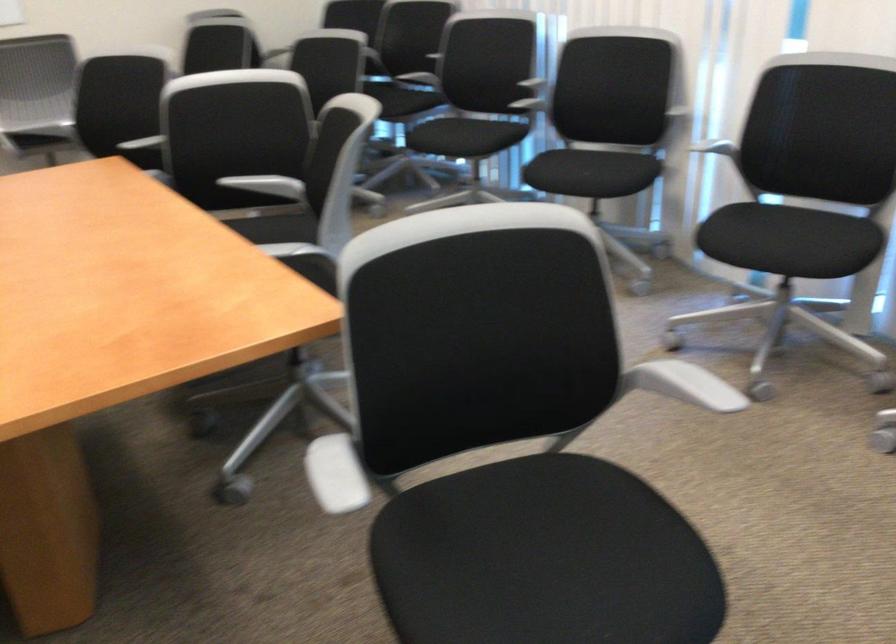
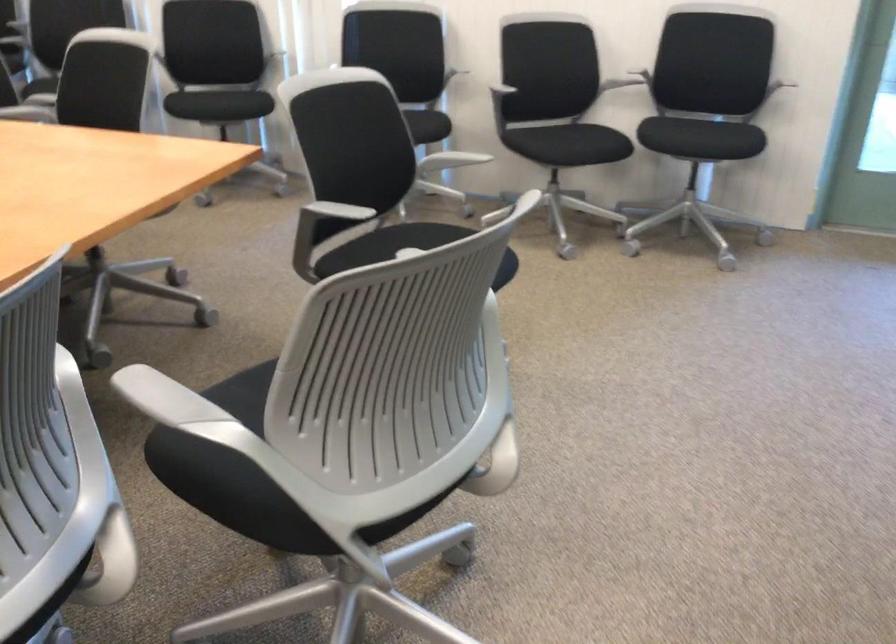
Locate, in the second image, the point that corresponds to point 323,460 in the first image.

(332, 212)